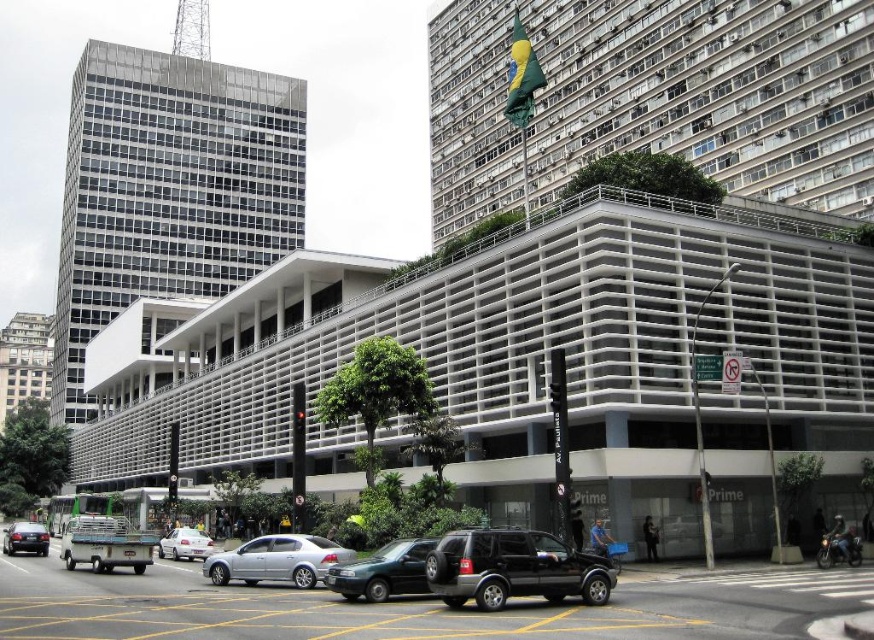
Who is positioned more to the left, black matte suv at center or metallic gray sedan at center?

Positioned to the left is metallic gray sedan at center.

At what (x,y) coordinates should I click in order to perform the action: click on black matte suv at center. Please return your answer as a coordinate pair (x, y). The height and width of the screenshot is (640, 874). Looking at the image, I should click on (512, 568).

Between black matte suv at center and shiny silver sedan at lower left, which one is positioned lower?

shiny silver sedan at lower left

Which is behind, point (459, 580) or point (30, 531)?

Point (30, 531)

This screenshot has height=640, width=874. What are the coordinates of `black matte suv at center` in the screenshot? It's located at pyautogui.click(x=512, y=568).

The width and height of the screenshot is (874, 640). In order to click on black matte suv at center in this screenshot , I will do `click(512, 568)`.

Can you confirm if metallic gray sedan at center is positioned below shiny silver sedan at lower left?

Actually, metallic gray sedan at center is above shiny silver sedan at lower left.

Can you confirm if metallic gray sedan at center is wider than shiny silver sedan at lower left?

No, metallic gray sedan at center is not wider than shiny silver sedan at lower left.

Between point (349, 573) and point (37, 540), which one is positioned behind?

Positioned behind is point (37, 540).

Find the location of a particular element. metallic gray sedan at center is located at coordinates (383, 572).